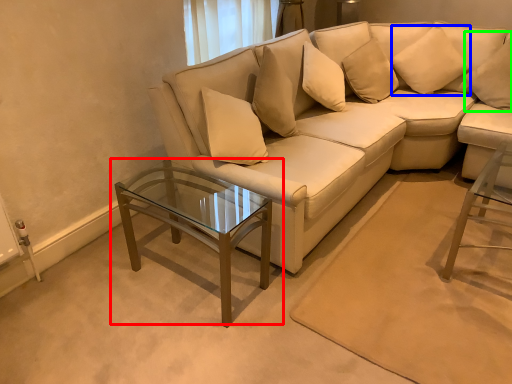
Question: Which object is the farthest from coffee table (highlighted by a red box)? Choose among these: pillow (highlighted by a blue box) or pillow (highlighted by a green box).

Choices:
 (A) pillow
 (B) pillow

Answer: (B)